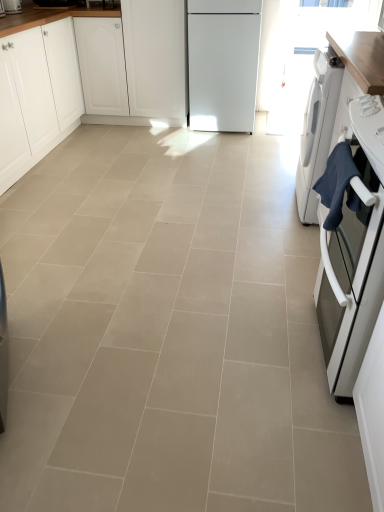
In order to face white matte cabinet at left, placed as the 2th cabinetry when sorted from right to left, should I rotate leftwards or rightwards?

It's best to rotate left around 24.288 degrees.

The height and width of the screenshot is (512, 384). Describe the element at coordinates (156, 58) in the screenshot. I see `white matte cabinet at center, the first cabinetry in the right-to-left sequence` at that location.

This screenshot has height=512, width=384. I want to click on white glossy oven at right, marked as the 1th home appliance in a front-to-back arrangement, so click(354, 253).

Locate an element on the screen. white glossy washing machine at right, which is counted as the first home appliance, starting from the back is located at coordinates (317, 130).

The height and width of the screenshot is (512, 384). I want to click on beige ceramic tile at center, so click(168, 332).

Would you consider white matte cabinet at left, placed as the 1th cabinetry when sorted from left to right, to be distant from white glossy washing machine at right, the 2th home appliance when ordered from front to back?

Yes, white matte cabinet at left, placed as the 1th cabinetry when sorted from left to right, and white glossy washing machine at right, the 2th home appliance when ordered from front to back, are located far from each other.

Which of these two, white matte cabinet at left, placed as the 2th cabinetry when sorted from right to left, or white glossy washing machine at right, which is counted as the first home appliance, starting from the back, is bigger?

white matte cabinet at left, placed as the 2th cabinetry when sorted from right to left.

Is white matte cabinet at left, placed as the 1th cabinetry when sorted from left to right, situated inside white glossy washing machine at right, which is counted as the first home appliance, starting from the back, or outside?

white matte cabinet at left, placed as the 1th cabinetry when sorted from left to right, is located beyond the bounds of white glossy washing machine at right, which is counted as the first home appliance, starting from the back.

Is white matte cabinet at left, placed as the 2th cabinetry when sorted from right to left, closer to the viewer compared to white glossy washing machine at right, the 2th home appliance when ordered from front to back?

No, white matte cabinet at left, placed as the 2th cabinetry when sorted from right to left, is further to the viewer.

Could you tell me if white glossy oven at right, marked as the 1th home appliance in a front-to-back arrangement, is turned towards white glossy washing machine at right, which is counted as the first home appliance, starting from the back?

No, white glossy oven at right, marked as the 1th home appliance in a front-to-back arrangement, is not oriented towards white glossy washing machine at right, which is counted as the first home appliance, starting from the back.

Which of these two, white glossy oven at right, marked as the 1th home appliance in a front-to-back arrangement, or white glossy washing machine at right, the 2th home appliance when ordered from front to back, is wider?

white glossy oven at right, marked as the 1th home appliance in a front-to-back arrangement.

Is white glossy oven at right, marked as the 1th home appliance in a front-to-back arrangement, directly adjacent to white glossy washing machine at right, the 2th home appliance when ordered from front to back?

white glossy oven at right, marked as the 1th home appliance in a front-to-back arrangement, is not next to white glossy washing machine at right, the 2th home appliance when ordered from front to back, and they're not touching.

Considering the positions of objects beige ceramic tile at center and white matte cabinet at left, placed as the 1th cabinetry when sorted from left to right, in the image provided, who is more to the left, beige ceramic tile at center or white matte cabinet at left, placed as the 1th cabinetry when sorted from left to right,?

From the viewer's perspective, white matte cabinet at left, placed as the 1th cabinetry when sorted from left to right, appears more on the left side.

Where is `the 1st cabinetry positioned above the beige ceramic tile at center (from a real-world perspective)`? The image size is (384, 512). the 1st cabinetry positioned above the beige ceramic tile at center (from a real-world perspective) is located at coordinates point(37,95).

How different are the orientations of beige ceramic tile at center and white matte cabinet at left, placed as the 2th cabinetry when sorted from right to left, in degrees?

The facing directions of beige ceramic tile at center and white matte cabinet at left, placed as the 2th cabinetry when sorted from right to left, are 89.3 degrees apart.

Which is behind, beige ceramic tile at center or white matte cabinet at left, placed as the 1th cabinetry when sorted from left to right?

white matte cabinet at left, placed as the 1th cabinetry when sorted from left to right, is more distant.

Is matte white toaster at upper left smaller than beige ceramic tile at center?

Correct, matte white toaster at upper left occupies less space than beige ceramic tile at center.

Between matte white toaster at upper left and beige ceramic tile at center, which one appears on the left side from the viewer's perspective?

matte white toaster at upper left.

Does matte white toaster at upper left contain beige ceramic tile at center?

No, beige ceramic tile at center is not inside matte white toaster at upper left.

Can you confirm if matte white toaster at upper left is bigger than white matte cabinet at center, the first cabinetry in the right-to-left sequence?

No, matte white toaster at upper left is not bigger than white matte cabinet at center, the first cabinetry in the right-to-left sequence.

Is matte white toaster at upper left surrounding white matte cabinet at center, placed as the 2th cabinetry when sorted from left to right?

That's incorrect, white matte cabinet at center, placed as the 2th cabinetry when sorted from left to right, is not inside matte white toaster at upper left.

Considering the sizes of objects matte white toaster at upper left and white matte cabinet at center, the first cabinetry in the right-to-left sequence, in the image provided, who is wider, matte white toaster at upper left or white matte cabinet at center, the first cabinetry in the right-to-left sequence,?

white matte cabinet at center, the first cabinetry in the right-to-left sequence, is wider.

From the image's perspective, which is above, matte white toaster at upper left or white matte cabinet at center, placed as the 2th cabinetry when sorted from left to right?

matte white toaster at upper left is shown above in the image.

Does white glossy washing machine at right, which is counted as the first home appliance, starting from the back, have a lesser height compared to white glossy oven at right, marked as the 1th home appliance in a front-to-back arrangement?

No.

From the image's perspective, which is below, white glossy washing machine at right, which is counted as the first home appliance, starting from the back, or white glossy oven at right, marked as the 1th home appliance in a front-to-back arrangement?

white glossy oven at right, marked as the 1th home appliance in a front-to-back arrangement.

Could you tell me if white glossy washing machine at right, the 2th home appliance when ordered from front to back, is turned towards white glossy oven at right, marked as the 1th home appliance in a front-to-back arrangement?

No, white glossy washing machine at right, the 2th home appliance when ordered from front to back, is not oriented towards white glossy oven at right, marked as the 1th home appliance in a front-to-back arrangement.

Looking at the image, does white glossy washing machine at right, the 2th home appliance when ordered from front to back, seem bigger or smaller compared to white glossy oven at right, marked as the 1th home appliance in a front-to-back arrangement?

In the image, white glossy washing machine at right, the 2th home appliance when ordered from front to back, appears to be smaller than white glossy oven at right, marked as the 1th home appliance in a front-to-back arrangement.

Can you tell me how much beige ceramic tile at center and white glossy oven at right, marked as the 1th home appliance in a front-to-back arrangement, differ in facing direction?

They differ by 90.4 degrees in their facing directions.

Is white glossy oven at right, arranged as the second home appliance when viewed from the back, located within beige ceramic tile at center?

No, beige ceramic tile at center does not contain white glossy oven at right, arranged as the second home appliance when viewed from the back.

Consider the image. Considering the relative positions of beige ceramic tile at center and white glossy oven at right, marked as the 1th home appliance in a front-to-back arrangement, in the image provided, is beige ceramic tile at center to the left of white glossy oven at right, marked as the 1th home appliance in a front-to-back arrangement, from the viewer's perspective?

Yes.

The image size is (384, 512). In order to click on the 1st home appliance located beneath the white matte cabinet at left, placed as the 2th cabinetry when sorted from right to left (from a real-world perspective) in this screenshot , I will do `click(317, 130)`.

Find the location of `home appliance that is on the left side of white glossy washing machine at right, which is counted as the first home appliance, starting from the back`. home appliance that is on the left side of white glossy washing machine at right, which is counted as the first home appliance, starting from the back is located at coordinates (354, 253).

Looking at the image, which one is located further to white matte cabinet at left, placed as the 1th cabinetry when sorted from left to right, white glossy washing machine at right, which is counted as the first home appliance, starting from the back, or beige ceramic tile at center?

Among the two, white glossy washing machine at right, which is counted as the first home appliance, starting from the back, is located further to white matte cabinet at left, placed as the 1th cabinetry when sorted from left to right.

Based on their spatial positions, is white matte cabinet at center, placed as the 2th cabinetry when sorted from left to right, or white matte cabinet at left, placed as the 1th cabinetry when sorted from left to right, further from white glossy oven at right, arranged as the second home appliance when viewed from the back?

The object further to white glossy oven at right, arranged as the second home appliance when viewed from the back, is white matte cabinet at center, placed as the 2th cabinetry when sorted from left to right.

Which object lies further to the anchor point white glossy oven at right, arranged as the second home appliance when viewed from the back, white glossy washing machine at right, the 2th home appliance when ordered from front to back, or beige ceramic tile at center?

The object further to white glossy oven at right, arranged as the second home appliance when viewed from the back, is white glossy washing machine at right, the 2th home appliance when ordered from front to back.

From the image, which object appears to be nearer to white glossy oven at right, arranged as the second home appliance when viewed from the back, matte white toaster at upper left or beige ceramic tile at center?

The object closer to white glossy oven at right, arranged as the second home appliance when viewed from the back, is beige ceramic tile at center.

Estimate the real-world distances between objects in this image. Which object is further from white matte cabinet at center, the first cabinetry in the right-to-left sequence, matte white toaster at upper left or white glossy oven at right, marked as the 1th home appliance in a front-to-back arrangement?

white glossy oven at right, marked as the 1th home appliance in a front-to-back arrangement.

Considering their positions, is white matte cabinet at left, placed as the 1th cabinetry when sorted from left to right, positioned closer to white glossy oven at right, arranged as the second home appliance when viewed from the back, than white glossy washing machine at right, which is counted as the first home appliance, starting from the back?

white glossy washing machine at right, which is counted as the first home appliance, starting from the back, is positioned closer to the anchor white glossy oven at right, arranged as the second home appliance when viewed from the back.

Estimate the real-world distances between objects in this image. Which object is closer to matte white toaster at upper left, white matte cabinet at left, placed as the 2th cabinetry when sorted from right to left, or white glossy oven at right, arranged as the second home appliance when viewed from the back?

Among the two, white matte cabinet at left, placed as the 2th cabinetry when sorted from right to left, is located nearer to matte white toaster at upper left.

Estimate the real-world distances between objects in this image. Which object is closer to white matte cabinet at left, placed as the 2th cabinetry when sorted from right to left, beige ceramic tile at center or matte white toaster at upper left?

matte white toaster at upper left.

Locate an element on the screen. This screenshot has height=512, width=384. kitchen appliance situated between white matte cabinet at left, placed as the 1th cabinetry when sorted from left to right, and white glossy oven at right, arranged as the second home appliance when viewed from the back, from left to right is located at coordinates (12, 6).

This screenshot has height=512, width=384. I want to click on kitchen appliance between white matte cabinet at left, placed as the 1th cabinetry when sorted from left to right, and white matte cabinet at center, the first cabinetry in the right-to-left sequence, from left to right, so click(12, 6).

Where is `home appliance between white matte cabinet at left, placed as the 2th cabinetry when sorted from right to left, and white glossy washing machine at right, which is counted as the first home appliance, starting from the back, in the horizontal direction`? home appliance between white matte cabinet at left, placed as the 2th cabinetry when sorted from right to left, and white glossy washing machine at right, which is counted as the first home appliance, starting from the back, in the horizontal direction is located at coordinates (354, 253).

At what (x,y) coordinates should I click in order to perform the action: click on home appliance located between beige ceramic tile at center and white matte cabinet at center, the first cabinetry in the right-to-left sequence, in the depth direction. Please return your answer as a coordinate pair (x, y). This screenshot has height=512, width=384. Looking at the image, I should click on (317, 130).